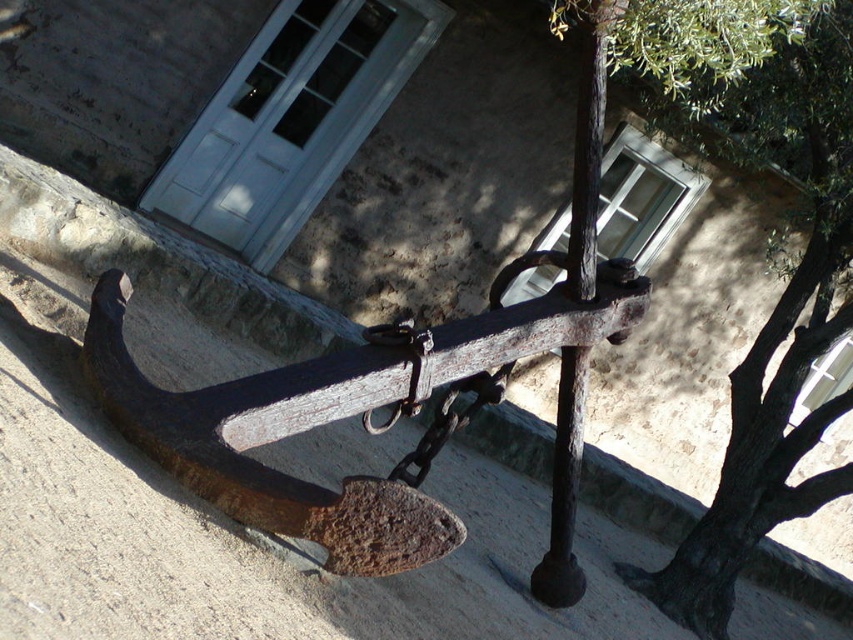
You are standing in front of the anchor and looking at the two points marked on the image. Which point, point (492, 349) or point (761, 355), is closer to you?

Point (492, 349) is closer to the camera than point (761, 355).

You are standing in front of the white door with a window above it. You want to walk towards the green leafy tree at upper right. Is the rusty metal anchor at center blocking your path?

The rusty metal anchor at center is positioned over green leafy tree at upper right, so the anchor is blocking the path to the tree.